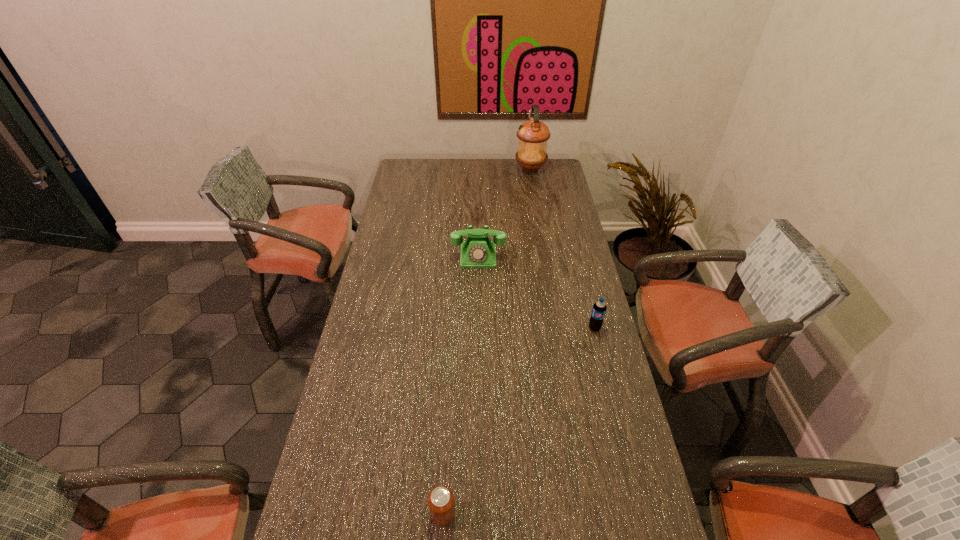
This screenshot has height=540, width=960. I want to click on the farthest object, so click(x=533, y=135).

I want to click on oil lamp, so click(533, 135).

Where is `telephone`? The width and height of the screenshot is (960, 540). telephone is located at coordinates (477, 251).

Locate an element on the screen. Image resolution: width=960 pixels, height=540 pixels. soda bottle is located at coordinates (599, 308).

This screenshot has height=540, width=960. I want to click on the third farthest object, so click(x=599, y=308).

Find the location of `the shortest object`. the shortest object is located at coordinates (441, 504).

Where is `the nearest object`? The height and width of the screenshot is (540, 960). the nearest object is located at coordinates (441, 504).

At what (x,y) coordinates should I click in order to perform the action: click on free space located 0.080m on the front of the farthest object. Please return your answer as a coordinate pair (x, y). Looking at the image, I should click on (534, 185).

Identify the location of free space located 0.280m on the dial of the second farthest object. (478, 322).

Identify the location of vacant space located 0.320m on the back of the soda bottle. This screenshot has width=960, height=540. (578, 262).